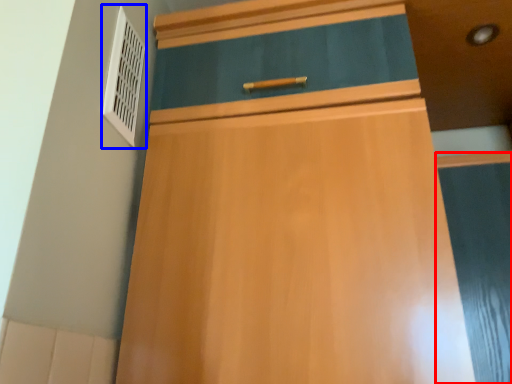
Question: Which point is closer to the camera, screen door (highlighted by a red box) or air conditioning (highlighted by a blue box)?

Choices:
 (A) screen door
 (B) air conditioning

Answer: (A)